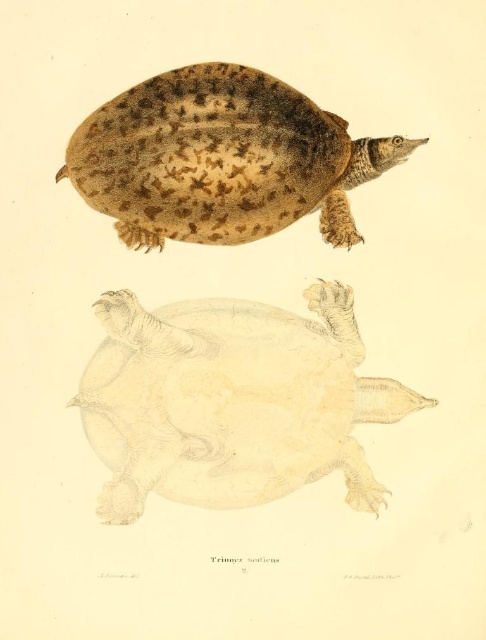
Question: In this image, where is beige textured shell at center located relative to brown textured shell at upper center?

Choices:
 (A) right
 (B) left

Answer: (A)

Question: Does beige textured shell at center have a lesser width compared to brown textured shell at upper center?

Choices:
 (A) no
 (B) yes

Answer: (B)

Question: Which object appears closest to the camera in this image?

Choices:
 (A) brown textured shell at upper center
 (B) beige textured shell at center

Answer: (B)

Question: Is beige textured shell at center below brown textured shell at upper center?

Choices:
 (A) yes
 (B) no

Answer: (A)

Question: Among these points, which one is farthest from the camera?

Choices:
 (A) (255, 128)
 (B) (133, 310)

Answer: (B)